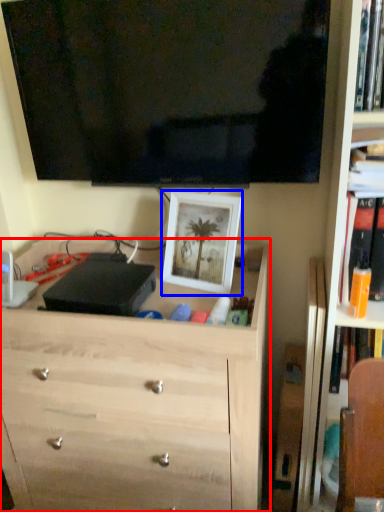
Question: Which point is further to the camera, chest of drawers (highlighted by a red box) or picture frame (highlighted by a blue box)?

Choices:
 (A) chest of drawers
 (B) picture frame

Answer: (B)